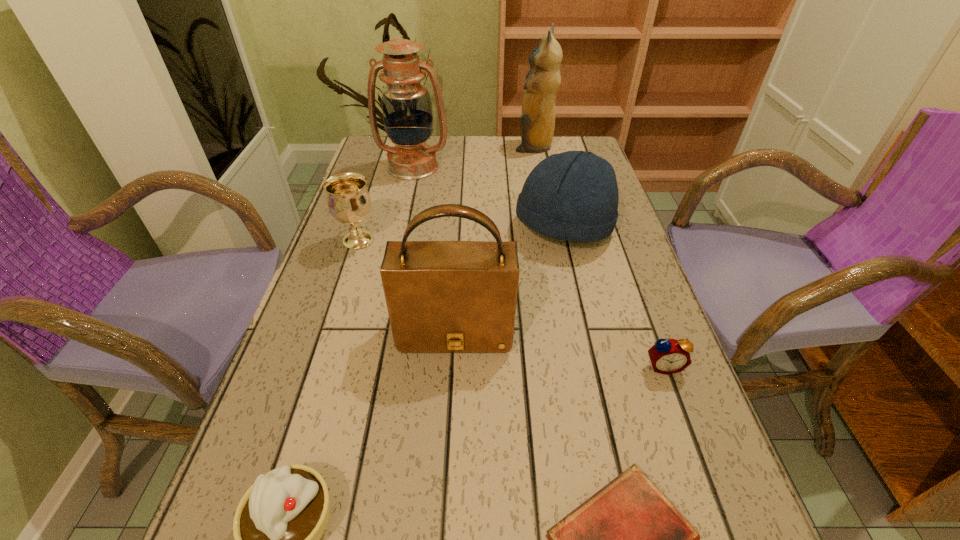
Locate an element on the screen. The image size is (960, 540). the farthest object is located at coordinates (543, 80).

Where is `oil lamp`? The image size is (960, 540). oil lamp is located at coordinates (407, 112).

The height and width of the screenshot is (540, 960). What are the coordinates of `shoulder bag` in the screenshot? It's located at (442, 296).

Identify the location of the fifth farthest object. (442, 296).

At what (x,y) coordinates should I click in order to perform the action: click on the fifth shortest object. Please return your answer as a coordinate pair (x, y). This screenshot has height=540, width=960. Looking at the image, I should click on (573, 196).

The width and height of the screenshot is (960, 540). In order to click on chalice in this screenshot , I will do `click(349, 202)`.

This screenshot has height=540, width=960. Identify the location of alarm clock. (667, 356).

At what (x,y) coordinates should I click in order to perform the action: click on vacant space positioned on the face of the cat. Please return your answer as a coordinate pair (x, y). The image size is (960, 540). Looking at the image, I should click on (443, 145).

You are a GUI agent. You are given a task and a screenshot of the screen. Output one action in this format:
    pyautogui.click(x=<x>, y=<y>)
    Task: Click on the vacant area situated on the face of the cat
    
    Given the screenshot: What is the action you would take?
    (x=416, y=145)

The width and height of the screenshot is (960, 540). What are the coordinates of `free space located on the face of the cat` in the screenshot? It's located at [433, 145].